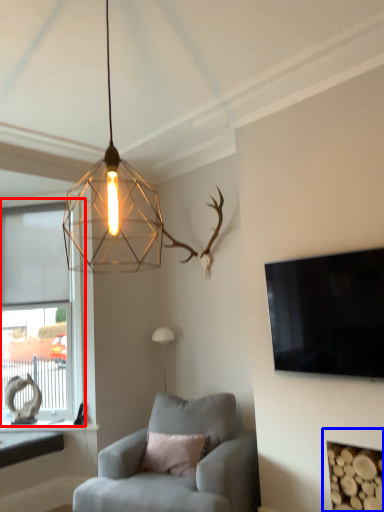
Question: Which point is further to the camera, window (highlighted by a red box) or fireplace (highlighted by a blue box)?

Choices:
 (A) window
 (B) fireplace

Answer: (A)